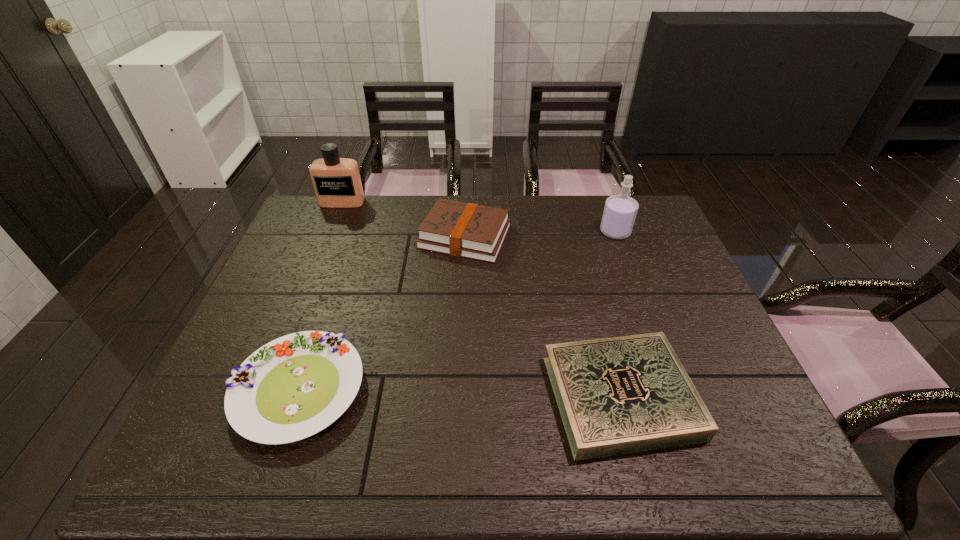
The image size is (960, 540). Find the location of `object at the far left corner`. object at the far left corner is located at coordinates (337, 183).

In order to click on object that is positioned at the near left corner in this screenshot , I will do `click(293, 387)`.

You are a GUI agent. You are given a task and a screenshot of the screen. Output one action in this format:
    pyautogui.click(x=<x>, y=<y>)
    Task: Click on the object that is positioned at the far right corner
    The width and height of the screenshot is (960, 540).
    Given the screenshot: What is the action you would take?
    pyautogui.click(x=620, y=211)

Image resolution: width=960 pixels, height=540 pixels. In order to click on object located at the near right corner in this screenshot , I will do [618, 395].

Locate an element on the screen. vacant space at the far edge is located at coordinates (574, 208).

In the image, there is a desktop. Where is `vacant area at the near edge`? vacant area at the near edge is located at coordinates (310, 455).

Identify the location of free space at the left edge. (214, 418).

Identify the location of vacant region at the right edge of the desktop. (655, 287).

Identify the location of vacant space at the far right corner of the desktop. This screenshot has width=960, height=540. (660, 215).

Find the location of `unoccupied area between the right perfume and the left hardback book`. unoccupied area between the right perfume and the left hardback book is located at coordinates (540, 234).